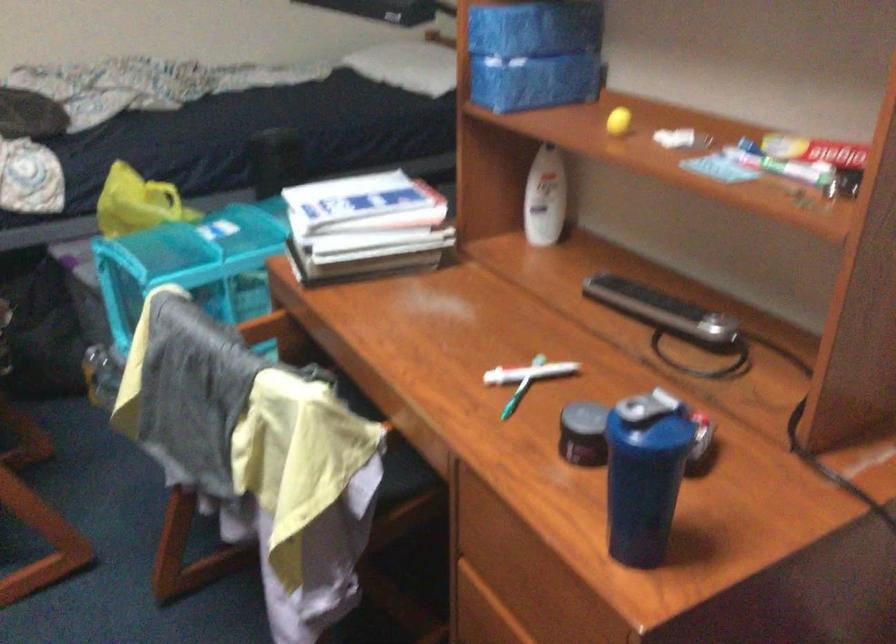
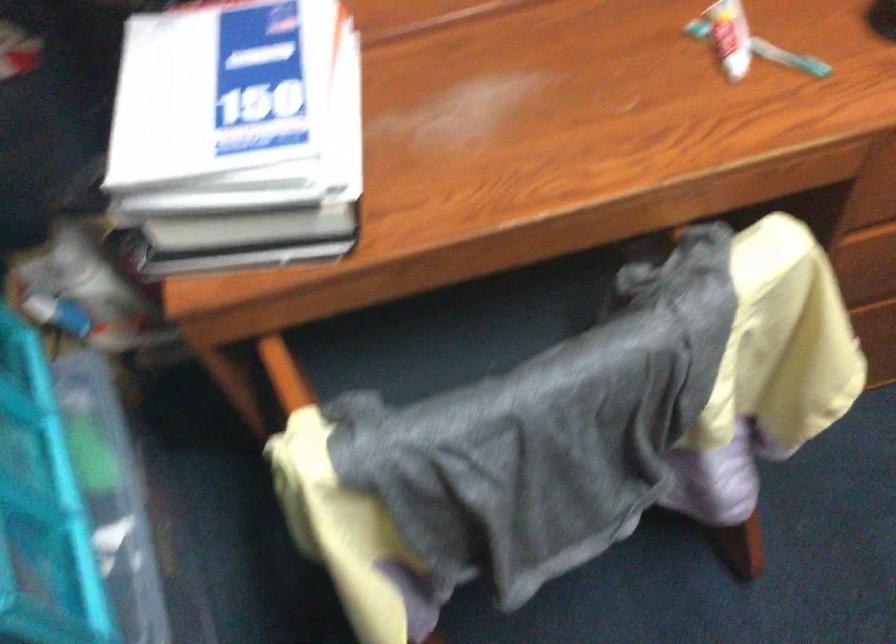
The point at [522,371] is marked in the first image. Where is the corresponding point in the second image?

(730, 37)